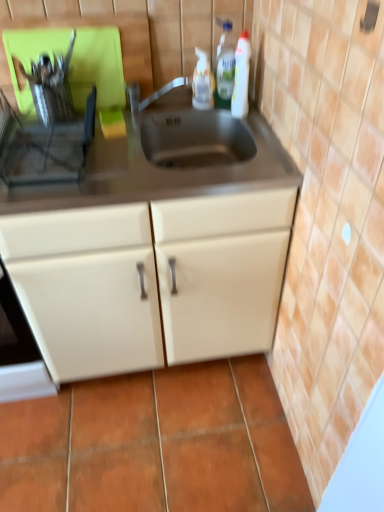
Find the location of a particular element. Image resolution: width=384 pixels, height=512 pixels. free spot above matte cream cabinet at center (from a real-world perspective) is located at coordinates (118, 154).